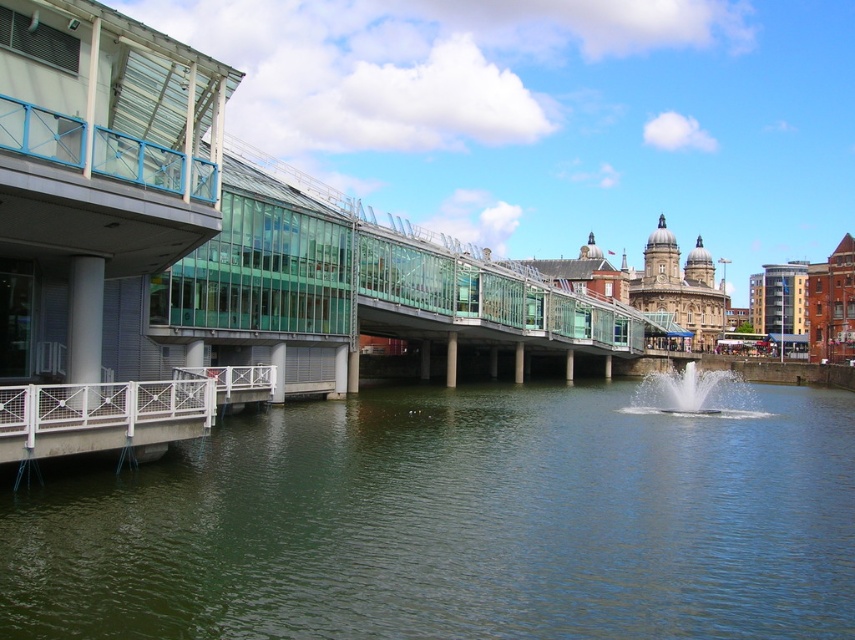
Question: Among these objects, which one is nearest to the camera?

Choices:
 (A) white frothy water at center
 (B) transparent glass bridge at center

Answer: (B)

Question: Is the position of greenish water at center more distant than that of transparent glass bridge at center?

Choices:
 (A) no
 (B) yes

Answer: (A)

Question: Considering the relative positions of transparent glass bridge at center and white frothy water at center in the image provided, where is transparent glass bridge at center located with respect to white frothy water at center?

Choices:
 (A) right
 (B) left

Answer: (B)

Question: Does greenish water at center appear over white frothy water at center?

Choices:
 (A) no
 (B) yes

Answer: (A)

Question: Which point is farther to the camera?

Choices:
 (A) (829, 632)
 (B) (302, 241)
 (C) (647, 396)

Answer: (C)

Question: Estimate the real-world distances between objects in this image. Which object is farther from the transparent glass bridge at center?

Choices:
 (A) white frothy water at center
 (B) greenish water at center

Answer: (A)